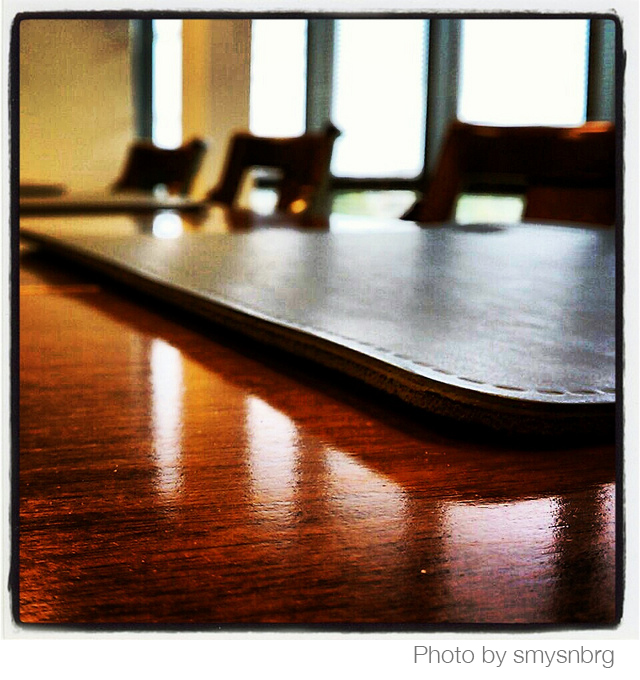
Find the location of a particular element. This screenshot has width=640, height=680. chairs is located at coordinates (163, 156), (312, 150), (545, 154).